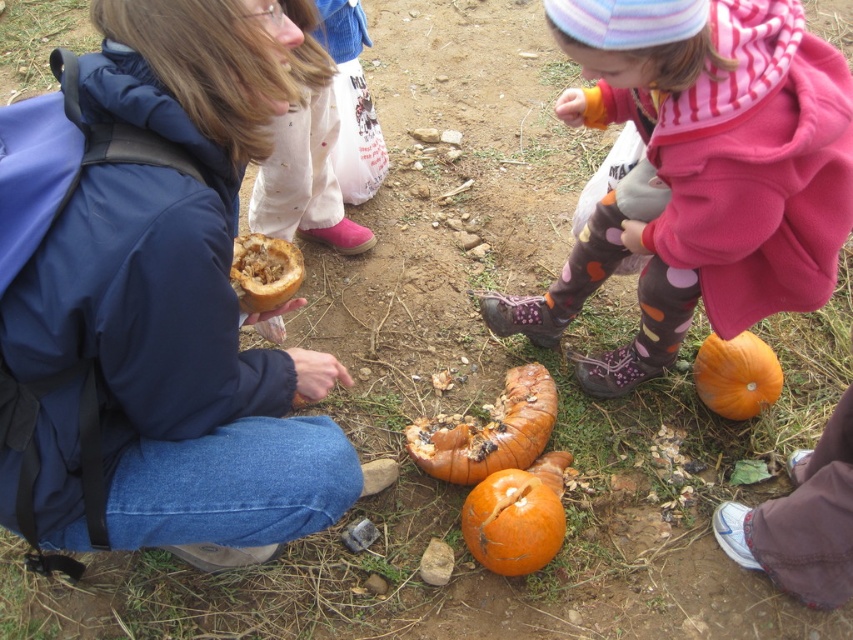
Consider the image. Is matte brown pumpkin at center taller than rotten pumpkin at center?

Correct, matte brown pumpkin at center is much taller as rotten pumpkin at center.

Who is more distant from viewer, (102, 298) or (448, 426)?

The point (448, 426) is behind.

Who is more distant from viewer, (231, 148) or (469, 435)?

Point (469, 435)

Identify the location of matte brown pumpkin at center. (155, 301).

Is matte brown pumpkin at center to the right of brown fibrous pumpkin at center from the viewer's perspective?

No, matte brown pumpkin at center is not to the right of brown fibrous pumpkin at center.

Is matte brown pumpkin at center below brown fibrous pumpkin at center?

Correct, matte brown pumpkin at center is located below brown fibrous pumpkin at center.

Is point (99, 504) in front of point (286, 280)?

That is True.

Where is `matte brown pumpkin at center`? The width and height of the screenshot is (853, 640). matte brown pumpkin at center is located at coordinates (155, 301).

Does matte brown pumpkin at center have a greater width compared to polka dot leggings at lower center?

Incorrect, matte brown pumpkin at center's width does not surpass polka dot leggings at lower center's.

Who is positioned more to the right, matte brown pumpkin at center or polka dot leggings at lower center?

Positioned to the right is polka dot leggings at lower center.

At what (x,y) coordinates should I click in order to perform the action: click on matte brown pumpkin at center. Please return your answer as a coordinate pair (x, y). Looking at the image, I should click on (155, 301).

At what (x,y) coordinates should I click in order to perform the action: click on matte brown pumpkin at center. Please return your answer as a coordinate pair (x, y). Looking at the image, I should click on point(155,301).